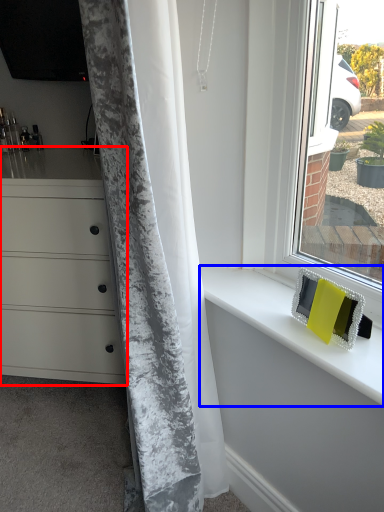
Question: Which of the following is the closest to the observer, chest of drawers (highlighted by a red box) or counter top (highlighted by a blue box)?

Choices:
 (A) chest of drawers
 (B) counter top

Answer: (B)